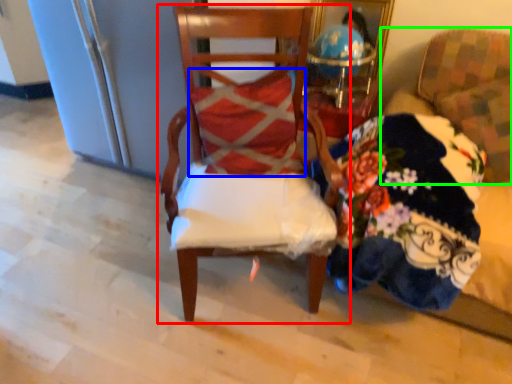
Question: Estimate the real-world distances between objects in this image. Which object is closer to chair (highlighted by a red box), pillow (highlighted by a blue box) or chair (highlighted by a green box)?

Choices:
 (A) pillow
 (B) chair

Answer: (A)